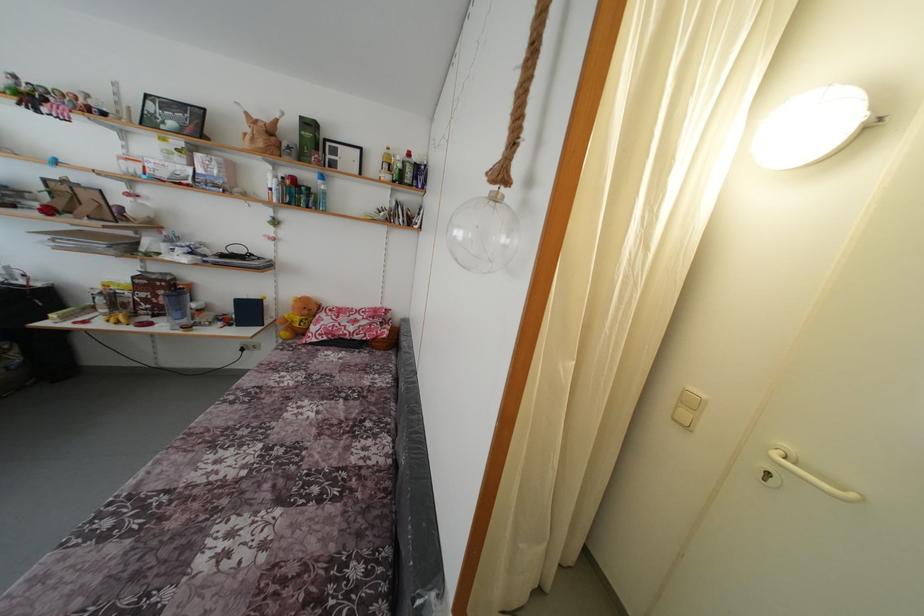
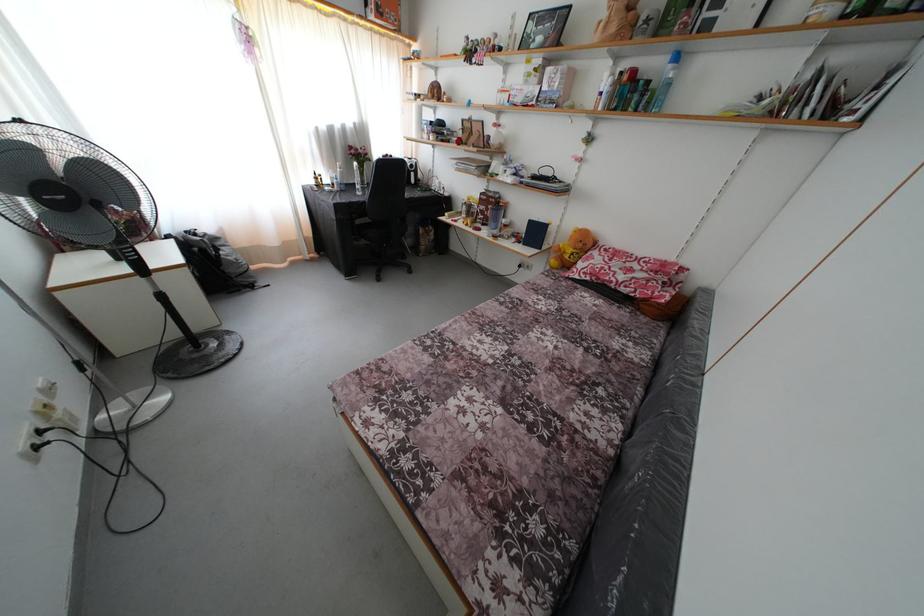
In the second image, find the point that corresponds to (287,355) in the first image.

(552, 282)